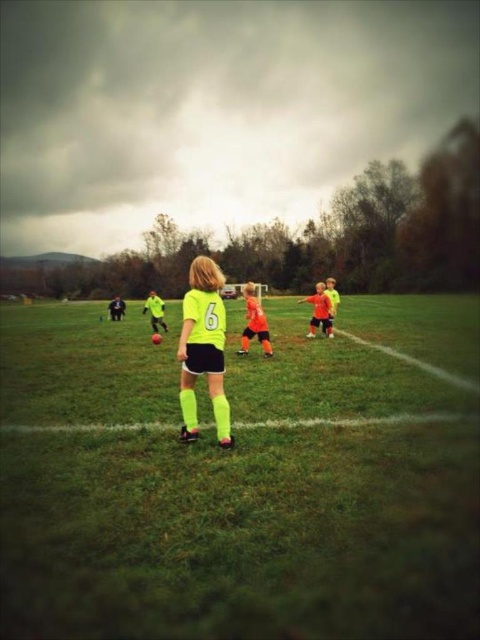
Between neon yellow jersey at center and orange matte soccer jersey at center, which one is positioned higher?

orange matte soccer jersey at center is higher up.

Is neon yellow jersey at center bigger than orange matte soccer jersey at center?

No.

The width and height of the screenshot is (480, 640). Identify the location of neon yellow jersey at center. (204, 348).

Where is `neon yellow socks at lower center`? neon yellow socks at lower center is located at coordinates (354, 420).

Based on the photo, is neon yellow socks at lower center thinner than orange jersey at center?

Correct, neon yellow socks at lower center's width is less than orange jersey at center's.

Where is `neon yellow socks at lower center`? The image size is (480, 640). neon yellow socks at lower center is located at coordinates (354, 420).

Between neon green jersey at center and neon yellow socks at lower center, which one has less height?

neon yellow socks at lower center

Which is behind, point (26, 371) or point (476, 416)?

Point (26, 371)

Locate an element on the screen. The height and width of the screenshot is (640, 480). neon green jersey at center is located at coordinates (241, 477).